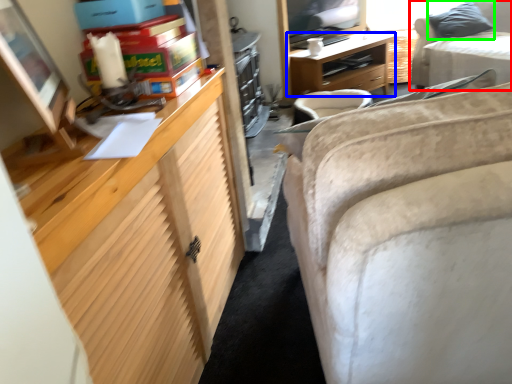
Question: Estimate the real-world distances between objects in this image. Which object is farther from studio couch (highlighted by a red box), desk (highlighted by a blue box) or pillow (highlighted by a green box)?

Choices:
 (A) desk
 (B) pillow

Answer: (A)